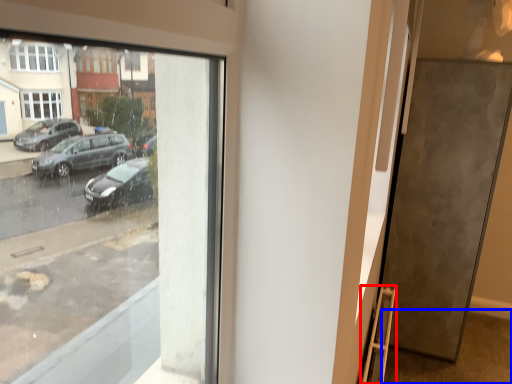
Question: Among these objects, which one is nearest to the camera, ladder (highlighted by a red box) or pavement (highlighted by a blue box)?

Choices:
 (A) ladder
 (B) pavement

Answer: (A)